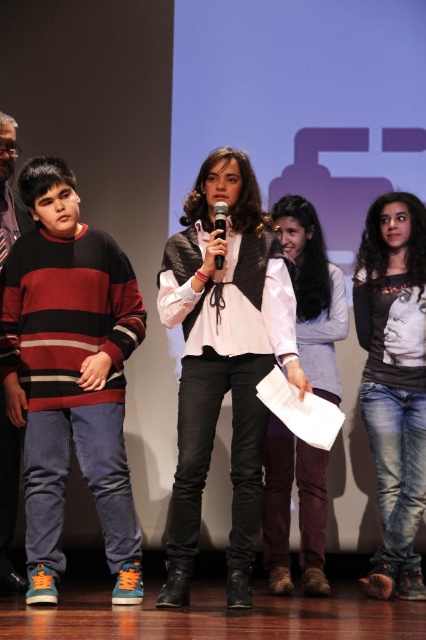
You are an event organizer who needs to arrange seating for a panel discussion. The panelists include the person wearing the striped sweater at left and the one in the white matte vest at center. If the distance between them on stage is 49.66 centimeters, will they be able to comfortably sit side by side on a standard conference bench seat that is 1.2 meters long?

The distance between the striped sweater at left and white matte vest at center is 49.66 centimeters. A standard conference bench seat is 1.2 meters long, which is 120 centimeters. Since 49.66 cm is less than half of 120 cm, they can comfortably sit side by side with ample space remaining.

You are an event organizer who needs to ensure that all materials are visible to the audience. Given the white paper at center and the black plastic microphone at center, which object is taller and might block the view of the other?

The white paper at center is taller than the black plastic microphone at center, so it might block the view of the microphone if positioned in front of it.

Based on the scene description, which object is wider between the striped sweater at left and the white matte vest at center?

The striped sweater at left is wider than the white matte vest at center.